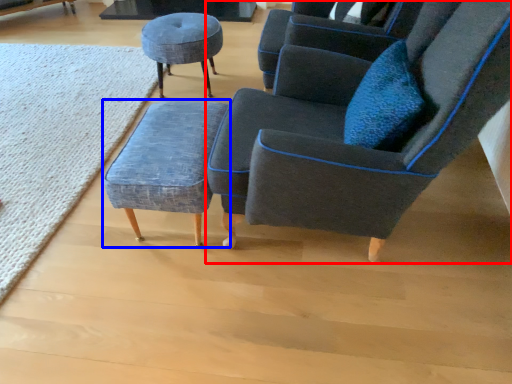
Question: Among these objects, which one is nearest to the camera, chair (highlighted by a red box) or stool (highlighted by a blue box)?

Choices:
 (A) chair
 (B) stool

Answer: (A)